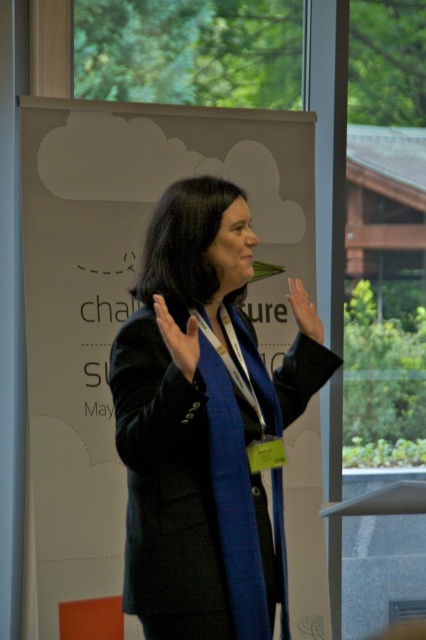
Question: Can you confirm if black woolen blazer at center is wider than blue fabric hand at center?

Choices:
 (A) no
 (B) yes

Answer: (B)

Question: Considering the real-world distances, which object is farthest from the blue fabric hand at center?

Choices:
 (A) black woolen blazer at center
 (B) matte black hand at upper center

Answer: (B)

Question: Which point appears closest to the camera in this image?

Choices:
 (A) (189, 368)
 (B) (242, 333)

Answer: (A)

Question: Does blue fabric hand at center have a smaller size compared to matte black hand at upper center?

Choices:
 (A) yes
 (B) no

Answer: (B)

Question: Is black woolen blazer at center below matte black hand at upper center?

Choices:
 (A) no
 (B) yes

Answer: (B)

Question: Which is nearer to the matte black hand at upper center?

Choices:
 (A) black woolen blazer at center
 (B) blue fabric hand at center

Answer: (A)